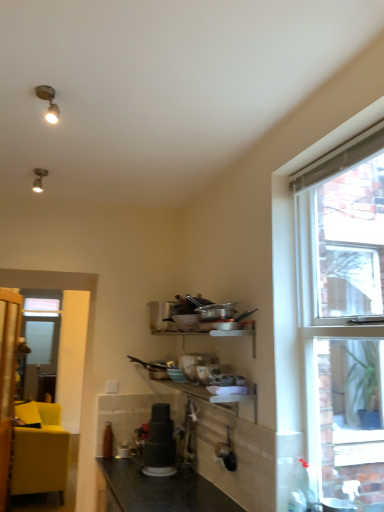
Question: Is clear glass window at upper right shorter than matte black blender at center?

Choices:
 (A) yes
 (B) no

Answer: (B)

Question: Is matte black blender at center inside clear glass window at upper right?

Choices:
 (A) yes
 (B) no

Answer: (B)

Question: Is clear glass window at upper right further to camera compared to matte black blender at center?

Choices:
 (A) yes
 (B) no

Answer: (B)

Question: Can you confirm if clear glass window at upper right is bigger than matte black blender at center?

Choices:
 (A) yes
 (B) no

Answer: (A)

Question: Can you confirm if clear glass window at upper right is positioned to the left of matte black blender at center?

Choices:
 (A) no
 (B) yes

Answer: (A)

Question: Could you tell me if clear glass window at upper right is facing matte black blender at center?

Choices:
 (A) yes
 (B) no

Answer: (B)

Question: Does matte black blender at center touch matte yellow couch at left?

Choices:
 (A) yes
 (B) no

Answer: (B)

Question: Does matte black blender at center come behind matte yellow couch at left?

Choices:
 (A) yes
 (B) no

Answer: (B)

Question: Is matte black blender at center not within matte yellow couch at left?

Choices:
 (A) no
 (B) yes

Answer: (B)

Question: From the image's perspective, is matte black blender at center on matte yellow couch at left?

Choices:
 (A) no
 (B) yes

Answer: (B)

Question: From the image's perspective, does matte black blender at center appear lower than matte yellow couch at left?

Choices:
 (A) yes
 (B) no

Answer: (B)

Question: Is matte black blender at center turned away from matte yellow couch at left?

Choices:
 (A) yes
 (B) no

Answer: (B)

Question: From a real-world perspective, is black granite countertop at lower center beneath matte black blender at center?

Choices:
 (A) yes
 (B) no

Answer: (A)